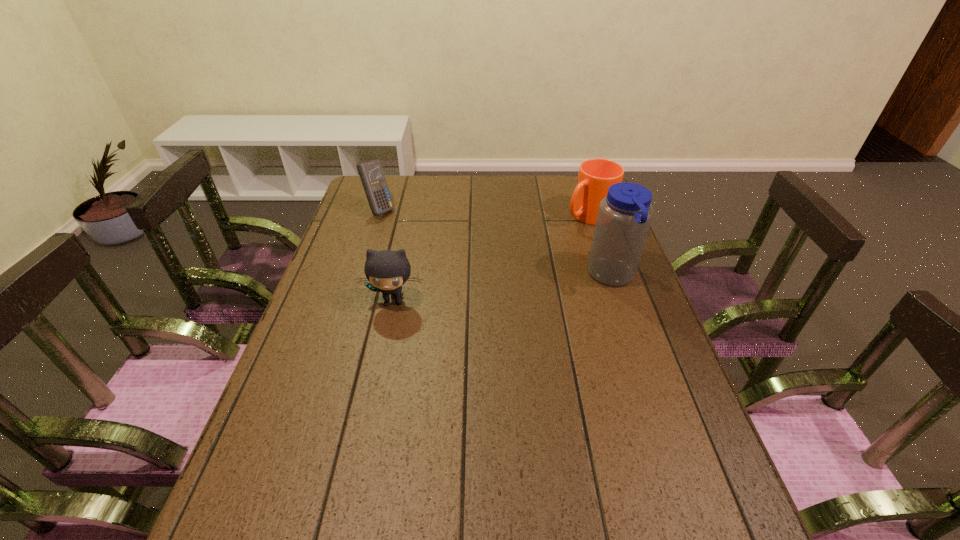
Locate an element on the screen. The width and height of the screenshot is (960, 540). kitten is located at coordinates (387, 271).

Identify the location of the tallest object. The image size is (960, 540). (624, 216).

Find the location of a particular element. This screenshot has width=960, height=540. calculator is located at coordinates (371, 174).

Identify the location of mug. (595, 176).

At what (x,y) coordinates should I click in order to perform the action: click on vacant position located on the front-facing side of the kitten. Please return your answer as a coordinate pair (x, y). The image size is (960, 540). Looking at the image, I should click on (364, 438).

Find the location of a particular element. free spot located with a carrying loop on the side of the water bottle is located at coordinates (472, 276).

Locate an element on the screen. blank area located with a carrying loop on the side of the water bottle is located at coordinates (492, 276).

The width and height of the screenshot is (960, 540). Find the location of `vacant space located 0.100m with a carrying loop on the side of the water bottle`. vacant space located 0.100m with a carrying loop on the side of the water bottle is located at coordinates (554, 276).

Where is `free space located on the front-facing side of the calculator`? free space located on the front-facing side of the calculator is located at coordinates (445, 248).

This screenshot has width=960, height=540. What are the coordinates of `free location located on the front-facing side of the calculator` in the screenshot? It's located at (417, 232).